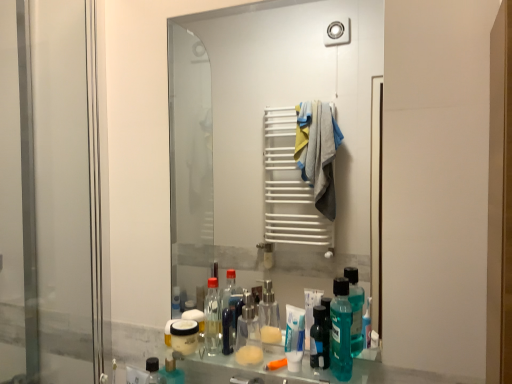
Question: Considering the relative positions of transparent glass screen door at left and clear glass mirror at center in the image provided, is transparent glass screen door at left to the right of clear glass mirror at center from the viewer's perspective?

Choices:
 (A) yes
 (B) no

Answer: (B)

Question: Is transparent glass screen door at left taller than clear glass mirror at center?

Choices:
 (A) no
 (B) yes

Answer: (B)

Question: Is transparent glass screen door at left surrounding clear glass mirror at center?

Choices:
 (A) yes
 (B) no

Answer: (B)

Question: From the image's perspective, is transparent glass screen door at left on top of clear glass mirror at center?

Choices:
 (A) no
 (B) yes

Answer: (A)

Question: Would you say transparent glass screen door at left is outside clear glass mirror at center?

Choices:
 (A) yes
 (B) no

Answer: (A)

Question: Does transparent glass screen door at left have a greater width compared to clear glass mirror at center?

Choices:
 (A) yes
 (B) no

Answer: (A)

Question: Could you tell me if teal plastic mouthwash at lower center is facing transparent glass screen door at left?

Choices:
 (A) no
 (B) yes

Answer: (A)

Question: Is teal plastic mouthwash at lower center oriented away from transparent glass screen door at left?

Choices:
 (A) no
 (B) yes

Answer: (A)

Question: Does teal plastic mouthwash at lower center have a greater height compared to transparent glass screen door at left?

Choices:
 (A) yes
 (B) no

Answer: (B)

Question: Considering the relative sizes of teal plastic mouthwash at lower center and transparent glass screen door at left in the image provided, is teal plastic mouthwash at lower center wider than transparent glass screen door at left?

Choices:
 (A) no
 (B) yes

Answer: (B)

Question: Does teal plastic mouthwash at lower center have a larger size compared to transparent glass screen door at left?

Choices:
 (A) no
 (B) yes

Answer: (A)

Question: From a real-world perspective, is teal plastic mouthwash at lower center under transparent glass screen door at left?

Choices:
 (A) no
 (B) yes

Answer: (B)

Question: Can you confirm if teal plastic mouthwash at lower center is taller than clear glass mirror at center?

Choices:
 (A) no
 (B) yes

Answer: (A)